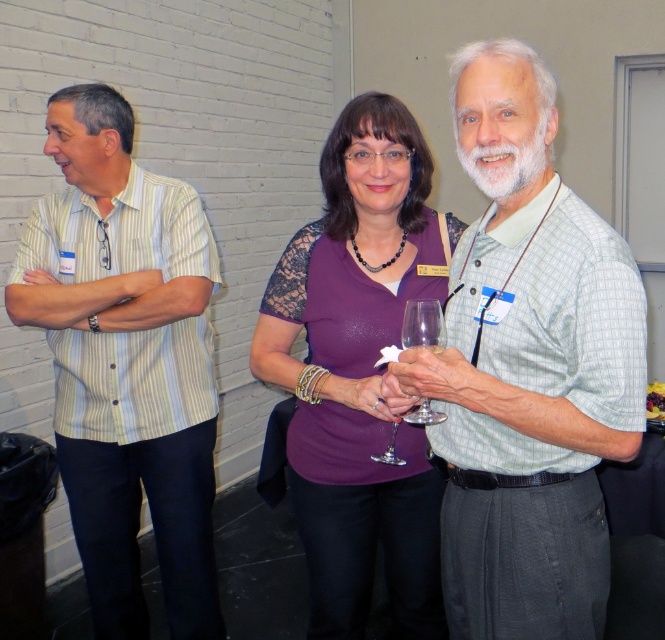
Question: Among these points, which one is farthest from the camera?

Choices:
 (A) (198, 358)
 (B) (428, 403)
 (C) (624, 289)
 (D) (442, 269)

Answer: (A)

Question: Is striped cotton shirt at left smaller than purple lace top at center?

Choices:
 (A) no
 (B) yes

Answer: (A)

Question: From the image, what is the correct spatial relationship of light green plaid shirt at center in relation to striped cotton shirt at left?

Choices:
 (A) above
 (B) below

Answer: (A)

Question: Which of the following is the closest to the observer?

Choices:
 (A) clear glass wine glass at center
 (B) light green plaid shirt at center
 (C) striped cotton shirt at left

Answer: (B)

Question: Can you confirm if purple lace top at center is wider than purple lace sleeve at center?

Choices:
 (A) no
 (B) yes

Answer: (B)

Question: Which point is closer to the camera?

Choices:
 (A) striped cotton shirt at left
 (B) purple lace sleeve at center

Answer: (B)